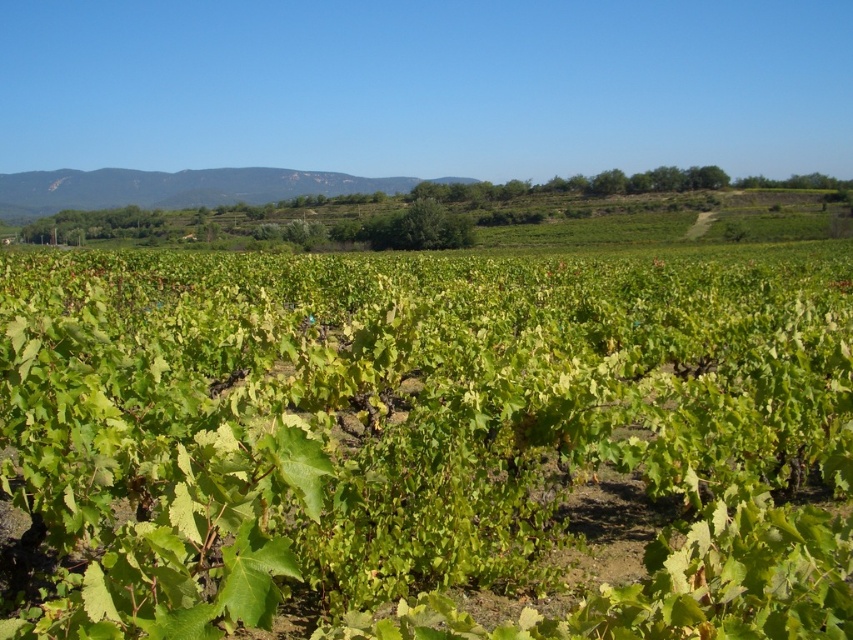
Question: Which point is farther to the camera?

Choices:
 (A) click(221, 184)
 (B) click(332, 518)

Answer: (A)

Question: Which point is farther from the camera taking this photo?

Choices:
 (A) (372, 188)
 (B) (531, 476)

Answer: (A)

Question: Is green leafy vines at center smaller than green grassy hillside at center?

Choices:
 (A) no
 (B) yes

Answer: (B)

Question: Which object appears farthest from the camera in this image?

Choices:
 (A) green leafy vines at center
 (B) green grassy hillside at center

Answer: (B)

Question: Considering the relative positions of green leafy vines at center and green grassy hillside at center in the image provided, where is green leafy vines at center located with respect to green grassy hillside at center?

Choices:
 (A) right
 (B) left

Answer: (A)

Question: Is green leafy vines at center smaller than green grassy hillside at center?

Choices:
 (A) no
 (B) yes

Answer: (B)